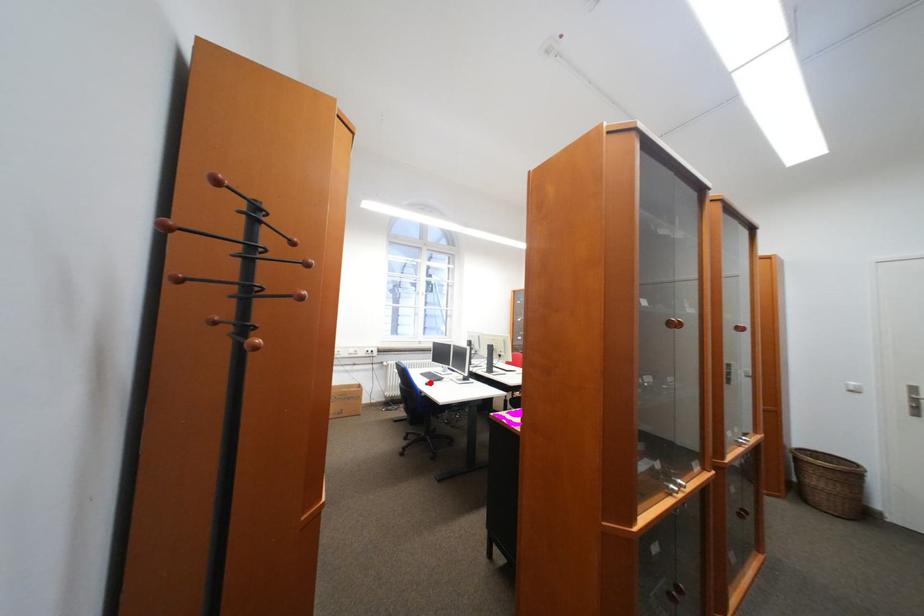
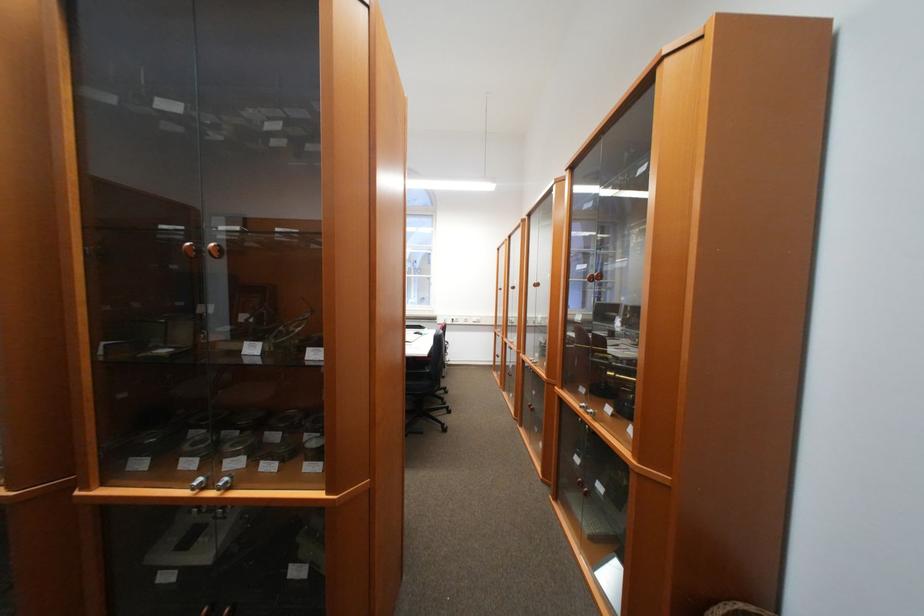
Question: I am providing you with two images of the same scene from different viewpoints. A red point is marked on the first image. Can you still see the location of the red point in image 2?

Choices:
 (A) Yes
 (B) No

Answer: (B)